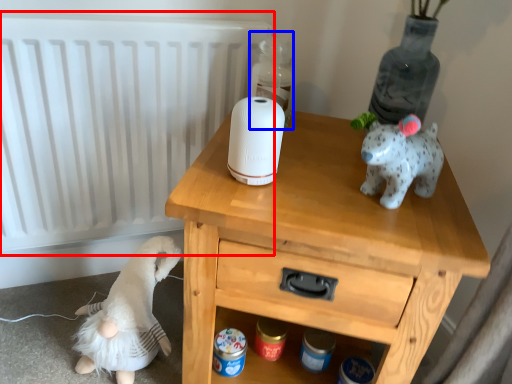
Question: Which object appears farthest to the camera in this image, radiator (highlighted by a red box) or bottle (highlighted by a blue box)?

Choices:
 (A) radiator
 (B) bottle

Answer: (B)